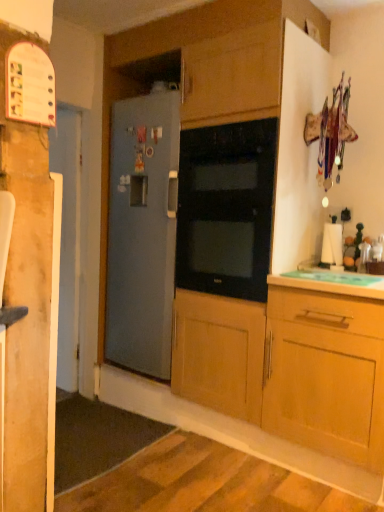
Image resolution: width=384 pixels, height=512 pixels. What do you see at coordinates (142, 233) in the screenshot?
I see `satin gray refrigerator at center` at bounding box center [142, 233].

Locate an element on the screen. This screenshot has height=512, width=384. black glass oven at center is located at coordinates (226, 209).

Identify the location of green plastic cutting board at lower right. (331, 282).

From a real-world perspective, who is located higher, green plastic cutting board at lower right or black glass oven at center?

In real-world perspective, black glass oven at center is above.

Who is taller, green plastic cutting board at lower right or black glass oven at center?

With more height is black glass oven at center.

Is green plastic cutting board at lower right at the right side of black glass oven at center?

Correct, you'll find green plastic cutting board at lower right to the right of black glass oven at center.

Between green plastic cutting board at lower right and black glass oven at center, which one has larger size?

black glass oven at center is bigger.

Which of these two, black glass oven at center or green plastic cutting board at lower right, is wider?

With larger width is black glass oven at center.

Where is `countertop on the right of the black glass oven at center`? This screenshot has width=384, height=512. countertop on the right of the black glass oven at center is located at coordinates (331, 282).

Considering the relative positions of black glass oven at center and green plastic cutting board at lower right in the image provided, is black glass oven at center in front of green plastic cutting board at lower right?

No, it is behind green plastic cutting board at lower right.

Between black glass oven at center and green plastic cutting board at lower right, which one appears on the left side from the viewer's perspective?

black glass oven at center.

From the image's perspective, is green plastic cutting board at lower right above or below satin gray refrigerator at center?

From the image's perspective, green plastic cutting board at lower right appears below satin gray refrigerator at center.

Identify the location of refrigerator that is behind the green plastic cutting board at lower right. (142, 233).

From a real-world perspective, is green plastic cutting board at lower right physically located above or below satin gray refrigerator at center?

green plastic cutting board at lower right is situated lower than satin gray refrigerator at center in the real world.

Who is bigger, white glossy door at left or satin gray refrigerator at center?

satin gray refrigerator at center.

Which object is more forward, white glossy door at left or satin gray refrigerator at center?

satin gray refrigerator at center.

Is satin gray refrigerator at center inside white glossy door at left?

No, satin gray refrigerator at center is not inside white glossy door at left.

Can you confirm if white glossy door at left is taller than satin gray refrigerator at center?

Yes.

Is black glass oven at center at the back of white glossy door at left?

No.

Is point (72, 373) behind point (213, 221)?

Yes, point (72, 373) is farther from viewer.

Is white glossy door at left far away from black glass oven at center?

white glossy door at left is positioned a significant distance from black glass oven at center.

Would you say white glossy door at left is outside black glass oven at center?

white glossy door at left is positioned outside black glass oven at center.

Considering the sizes of objects black glass oven at center and satin gray refrigerator at center in the image provided, who is shorter, black glass oven at center or satin gray refrigerator at center?

black glass oven at center is shorter.

Considering the sizes of objects black glass oven at center and satin gray refrigerator at center in the image provided, who is smaller, black glass oven at center or satin gray refrigerator at center?

With smaller size is black glass oven at center.

Where is `oven in front of the satin gray refrigerator at center`? The height and width of the screenshot is (512, 384). oven in front of the satin gray refrigerator at center is located at coordinates (226, 209).

Is satin gray refrigerator at center at the back of black glass oven at center?

black glass oven at center is not turned away from satin gray refrigerator at center.

From a real-world perspective, who is located lower, green plastic cutting board at lower right or white glossy door at left?

white glossy door at left.

Would you say green plastic cutting board at lower right is inside or outside white glossy door at left?

The correct answer is: outside.

This screenshot has width=384, height=512. I want to click on door above the green plastic cutting board at lower right (from the image's perspective), so click(x=68, y=242).

Is green plastic cutting board at lower right facing away from white glossy door at left?

No, white glossy door at left is not at the back of green plastic cutting board at lower right.

Locate an element on the screen. This screenshot has height=512, width=384. countertop on the right of black glass oven at center is located at coordinates (331, 282).

Locate an element on the screen. oven behind the green plastic cutting board at lower right is located at coordinates (226, 209).

Consider the image. Estimate the real-world distances between objects in this image. Which object is closer to green plastic cutting board at lower right, white glossy door at left or satin gray refrigerator at center?

satin gray refrigerator at center is positioned closer to the anchor green plastic cutting board at lower right.

From the picture: When comparing their distances from black glass oven at center, does white glossy door at left or green plastic cutting board at lower right seem further?

white glossy door at left lies further to black glass oven at center than the other object.

Considering their positions, is black glass oven at center positioned closer to white glossy door at left than green plastic cutting board at lower right?

black glass oven at center is closer to white glossy door at left.

Looking at the image, which one is located closer to satin gray refrigerator at center, white glossy door at left or black glass oven at center?

The object closer to satin gray refrigerator at center is black glass oven at center.

When comparing their distances from white glossy door at left, does green plastic cutting board at lower right or black glass oven at center seem closer?

black glass oven at center.

When comparing their distances from black glass oven at center, does green plastic cutting board at lower right or satin gray refrigerator at center seem closer?

Among the two, satin gray refrigerator at center is located nearer to black glass oven at center.

Which object lies nearer to the anchor point black glass oven at center, white glossy door at left or satin gray refrigerator at center?

Based on the image, satin gray refrigerator at center appears to be nearer to black glass oven at center.

When comparing their distances from green plastic cutting board at lower right, does white glossy door at left or black glass oven at center seem further?

white glossy door at left.

This screenshot has height=512, width=384. I want to click on refrigerator between white glossy door at left and green plastic cutting board at lower right from left to right, so click(142, 233).

You are a GUI agent. You are given a task and a screenshot of the screen. Output one action in this format:
    pyautogui.click(x=<x>, y=<y>)
    Task: Click on the oven between satin gray refrigerator at center and green plastic cutting board at lower right in the horizontal direction
    The image size is (384, 512).
    Given the screenshot: What is the action you would take?
    pyautogui.click(x=226, y=209)

This screenshot has height=512, width=384. I want to click on oven between white glossy door at left and green plastic cutting board at lower right in the horizontal direction, so click(x=226, y=209).

I want to click on refrigerator between white glossy door at left and black glass oven at center, so click(x=142, y=233).